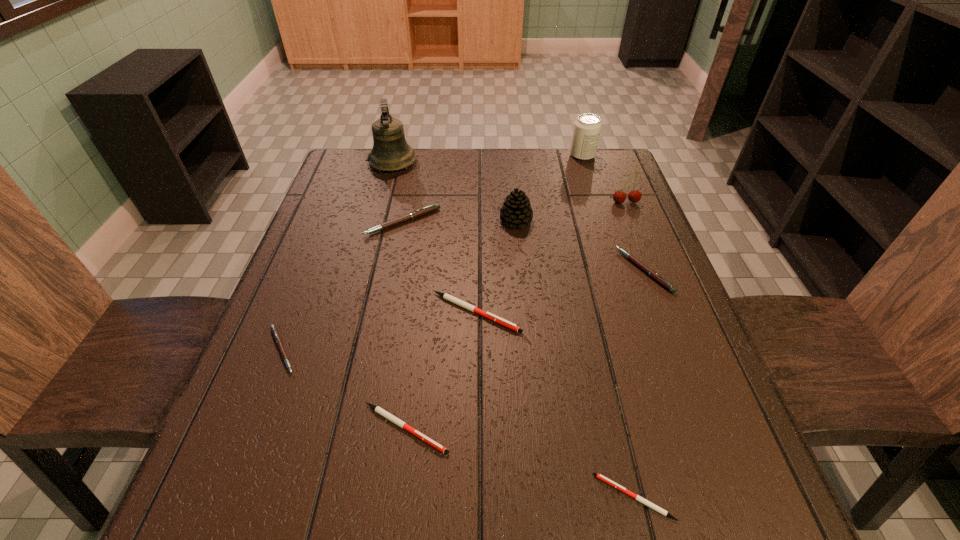
The height and width of the screenshot is (540, 960). I want to click on the leftmost object, so click(277, 338).

The image size is (960, 540). I want to click on the second nearest white pen, so click(379, 410).

At what (x,y) coordinates should I click in order to perform the action: click on the fifth farthest pen. Please return your answer as a coordinate pair (x, y). The image size is (960, 540). Looking at the image, I should click on (379, 410).

Where is `the shortest object`? the shortest object is located at coordinates [x=599, y=476].

You are a GUI agent. You are given a task and a screenshot of the screen. Output one action in this format:
    pyautogui.click(x=<x>, y=<y>)
    Task: Click on the nearest pen
    
    Given the screenshot: What is the action you would take?
    pyautogui.click(x=599, y=476)

Locate an element on the screen. The width and height of the screenshot is (960, 540). vacant space located 0.360m on the front of the tallest object is located at coordinates (368, 258).

You are a GUI agent. You are given a task and a screenshot of the screen. Output one action in this format:
    pyautogui.click(x=<x>, y=<y>)
    Task: Click on the vacant region located on the front of the soda can
    
    Given the screenshot: What is the action you would take?
    pyautogui.click(x=604, y=221)

The width and height of the screenshot is (960, 540). I want to click on free space located on the surface of the cherry, so click(639, 237).

Find the location of `vacant space located at the narrow end of the pinecone`. vacant space located at the narrow end of the pinecone is located at coordinates (349, 221).

The image size is (960, 540). Identify the location of free point located 0.280m at the narrow end of the pinecone. (395, 221).